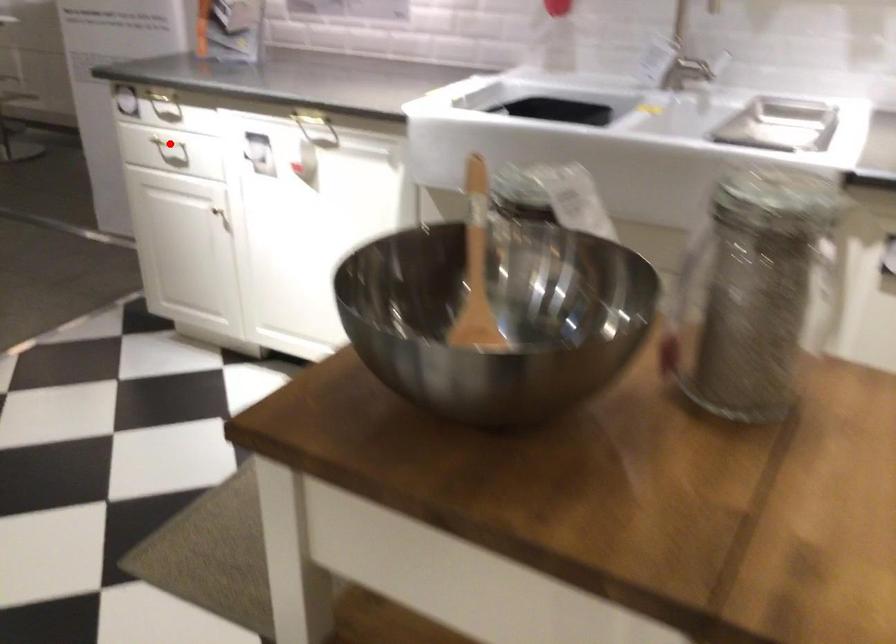
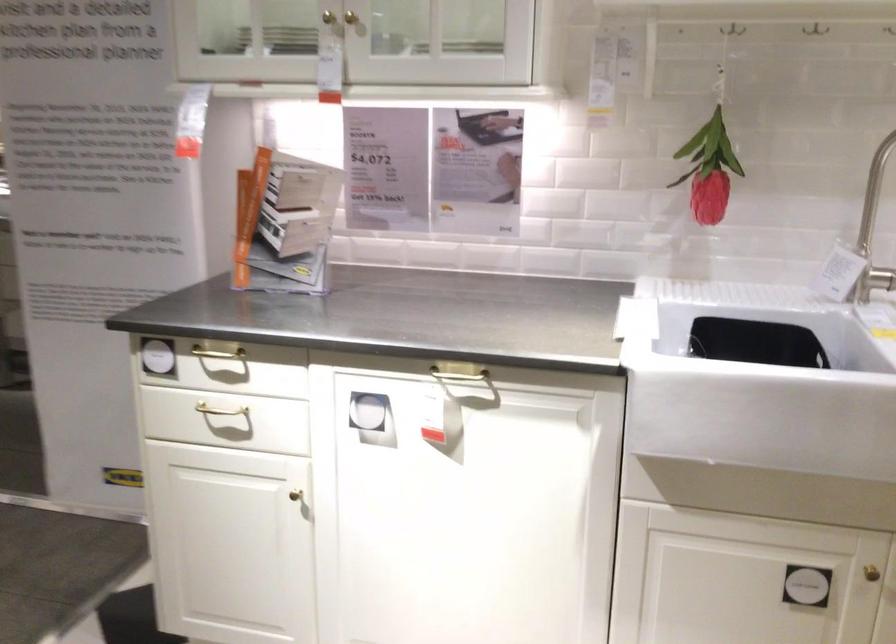
Question: I am providing you with two images of the same scene from different viewpoints. Image1 has a red point marked. In image2, the corresponding 3D location appears at what relative position? Reply with the corresponding letter.

Choices:
 (A) Closer
 (B) Farther

Answer: (A)